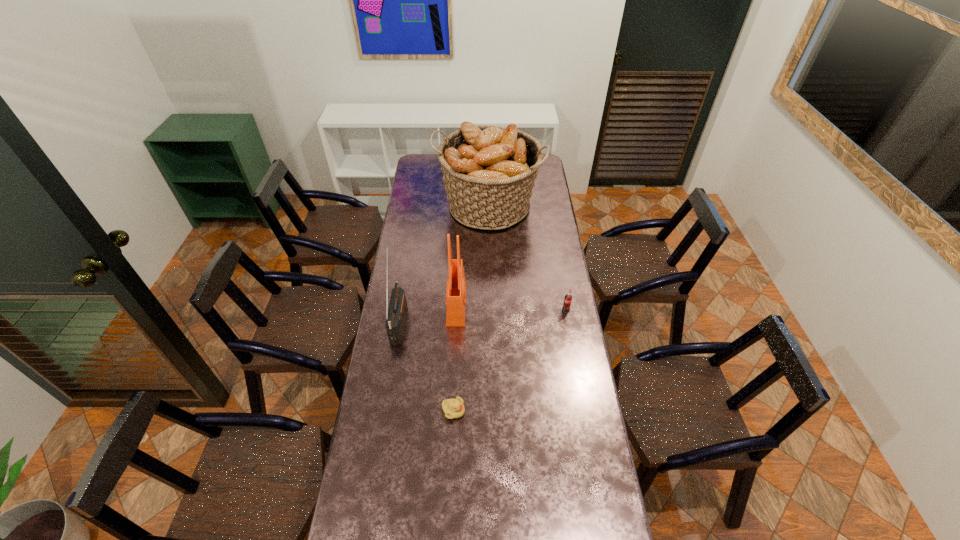
The width and height of the screenshot is (960, 540). I want to click on basket, so click(489, 172).

You are a GUI agent. You are given a task and a screenshot of the screen. Output one action in this format:
    pyautogui.click(x=<x>, y=<y>)
    Task: Click on the tote bag
    This screenshot has width=960, height=540.
    Given the screenshot: What is the action you would take?
    pyautogui.click(x=456, y=285)

The image size is (960, 540). I want to click on radio receiver, so click(396, 313).

Where is `the leftmost object`? the leftmost object is located at coordinates (396, 313).

Where is `soda bottle`? The height and width of the screenshot is (540, 960). soda bottle is located at coordinates (568, 298).

Identify the location of the rightmost object. (568, 298).

Identify the location of the nearest object. The height and width of the screenshot is (540, 960). (453, 408).

Locate an element on the screen. The height and width of the screenshot is (540, 960). the shortest object is located at coordinates (453, 408).

Image resolution: width=960 pixels, height=540 pixels. What are the coordinates of `blank area located 0.070m on the left of the farthest object` in the screenshot? It's located at (423, 207).

Find the location of a particular element. This screenshot has height=540, width=960. vacant region located on the logo side of the tote bag is located at coordinates (531, 305).